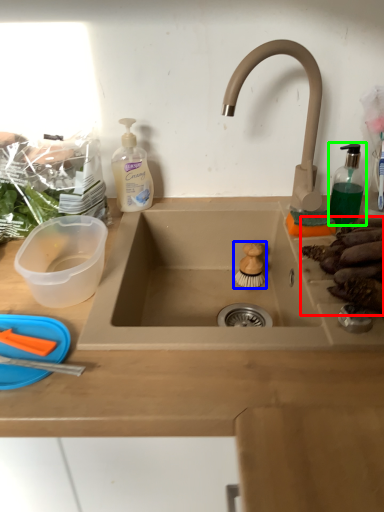
Question: Based on their relative distances, which object is nearer to food (highlighted by a red box)? Choose from food (highlighted by a blue box) and soap dispenser (highlighted by a green box).

Choices:
 (A) food
 (B) soap dispenser

Answer: (B)